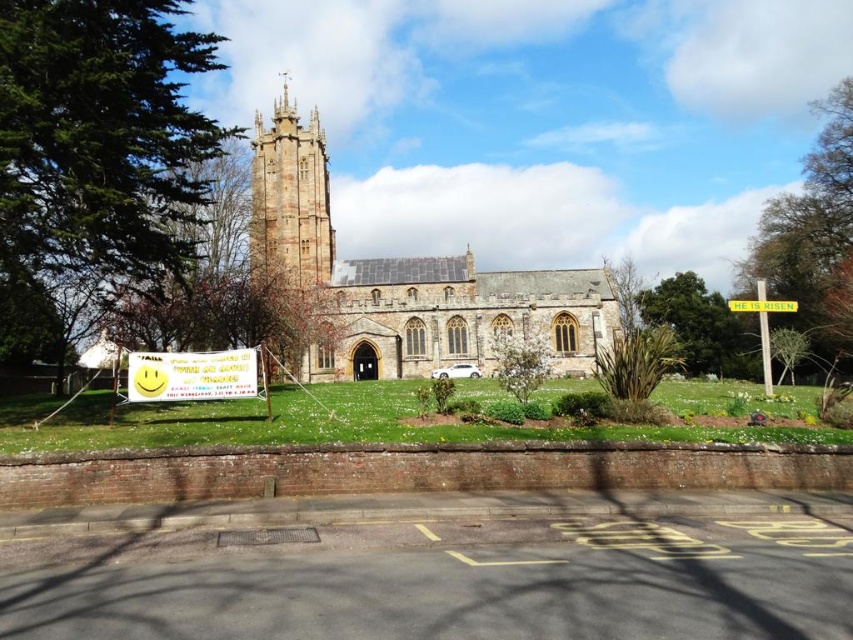
Question: Is stone gothic tower at center positioned before yellow plastic sign at center?

Choices:
 (A) no
 (B) yes

Answer: (A)

Question: Is yellow paper sign at center wider than yellow plastic sign at center?

Choices:
 (A) no
 (B) yes

Answer: (B)

Question: Is brown stone church at center smaller than yellow paper sign at center?

Choices:
 (A) yes
 (B) no

Answer: (B)

Question: Among these objects, which one is nearest to the camera?

Choices:
 (A) yellow plastic sign at center
 (B) brown stone church at center
 (C) yellow paper sign at center

Answer: (C)

Question: Which object is farther from the camera taking this photo?

Choices:
 (A) yellow plastic sign at right
 (B) stone gothic tower at center
 (C) yellow paper sign at center

Answer: (B)

Question: Considering the real-world distances, which object is closest to the yellow paper sign at center?

Choices:
 (A) yellow plastic sign at right
 (B) stone gothic tower at center
 (C) brown stone church at center

Answer: (C)